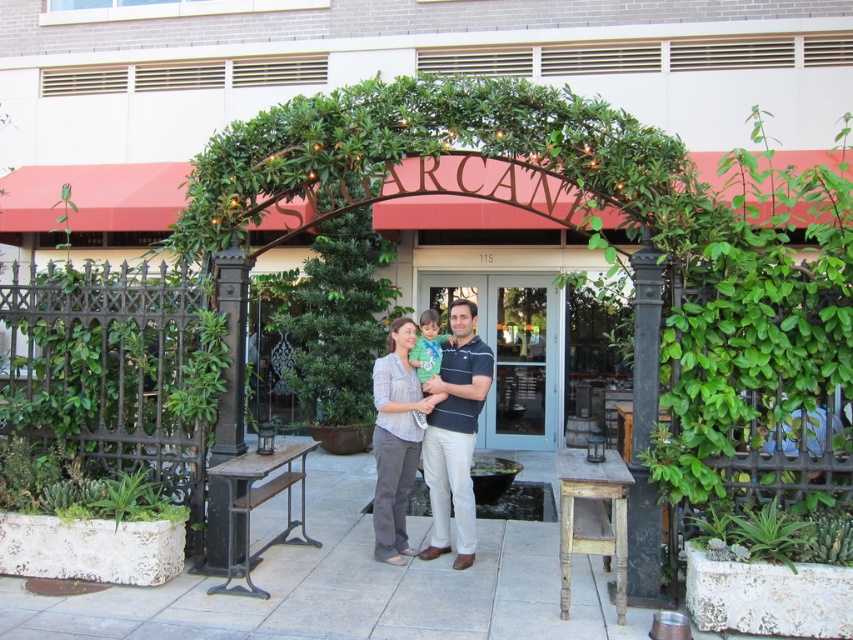
Is matte striped shirt at center taller than matte green shirt at center?

Indeed, matte striped shirt at center has a greater height compared to matte green shirt at center.

Which is above, matte striped shirt at center or matte green shirt at center?

matte green shirt at center is above.

At what (x,y) coordinates should I click in order to perform the action: click on matte striped shirt at center. Please return your answer as a coordinate pair (x, y). This screenshot has width=853, height=640. Looking at the image, I should click on (454, 433).

This screenshot has height=640, width=853. In order to click on matte striped shirt at center in this screenshot , I will do click(454, 433).

Does matte striped shirt at center appear over wooden rustic stool at center?

Correct, matte striped shirt at center is located above wooden rustic stool at center.

Does matte striped shirt at center have a greater height compared to wooden rustic stool at center?

Yes, matte striped shirt at center is taller than wooden rustic stool at center.

The image size is (853, 640). What do you see at coordinates (454, 433) in the screenshot?
I see `matte striped shirt at center` at bounding box center [454, 433].

The width and height of the screenshot is (853, 640). In order to click on matte striped shirt at center in this screenshot , I will do `click(454, 433)`.

Who is shorter, matte striped shirt at center or green succulent at lower right?

green succulent at lower right is shorter.

Between point (459, 365) and point (849, 522), which one is positioned in front?

Point (849, 522) is more forward.

Find the location of a particular element. Image resolution: width=853 pixels, height=640 pixels. matte striped shirt at center is located at coordinates (454, 433).